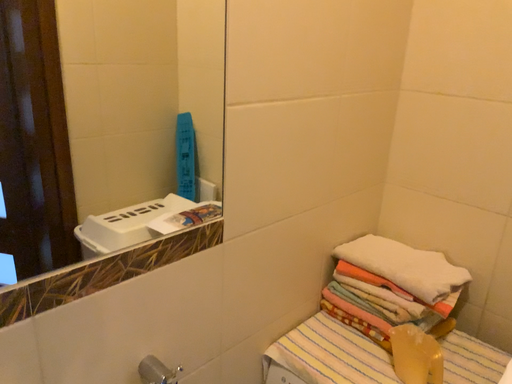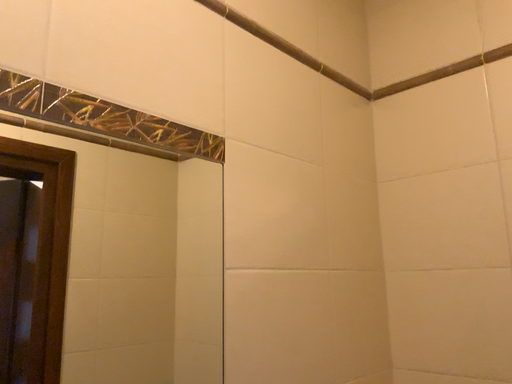
Question: Which way did the camera rotate in the video?

Choices:
 (A) rotated upward
 (B) rotated downward

Answer: (A)